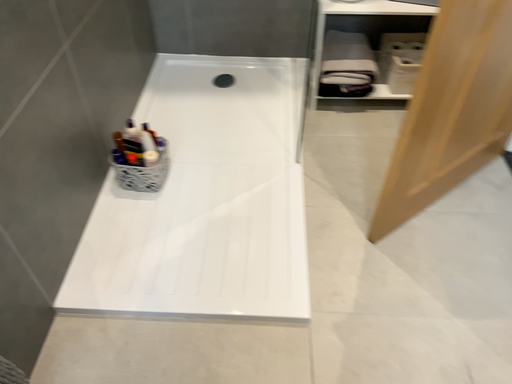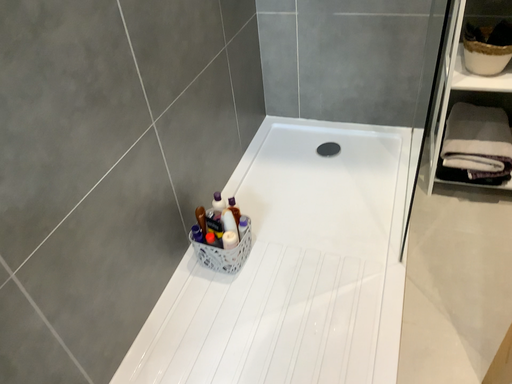
Question: How did the camera likely rotate when shooting the video?

Choices:
 (A) rotated left
 (B) rotated right

Answer: (A)